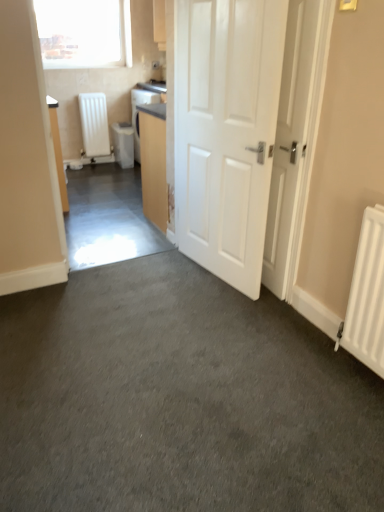
Question: Is matte wood cabinet at center to the left or to the right of white plastic water heater at center-left, arranged as the 2th water heater when viewed from the left, in the image?

Choices:
 (A) left
 (B) right

Answer: (B)

Question: Is matte wood cabinet at center inside or outside of white plastic water heater at center-left, which is counted as the 1th water heater, starting from the right?

Choices:
 (A) inside
 (B) outside

Answer: (B)

Question: Which is nearer to the white matte radiator at left, which appears as the first water heater when viewed from the left?

Choices:
 (A) transparent glass window at upper left
 (B) white plastic water heater at center-left, arranged as the 2th water heater when viewed from the left
 (C) matte wood cabinet at center
 (D) white matte door at center, which appears as the 1th door when viewed from the right
 (E) white glossy door at center, which is counted as the 1th door, starting from the left

Answer: (B)

Question: Based on their relative distances, which object is farther from the white matte door at center, which appears as the 1th door when viewed from the right?

Choices:
 (A) transparent glass window at upper left
 (B) white matte radiator at left, which appears as the first water heater when viewed from the left
 (C) white plastic water heater at center-left, arranged as the 2th water heater when viewed from the left
 (D) white glossy door at center, which is counted as the 1th door, starting from the left
 (E) matte wood cabinet at center

Answer: (A)